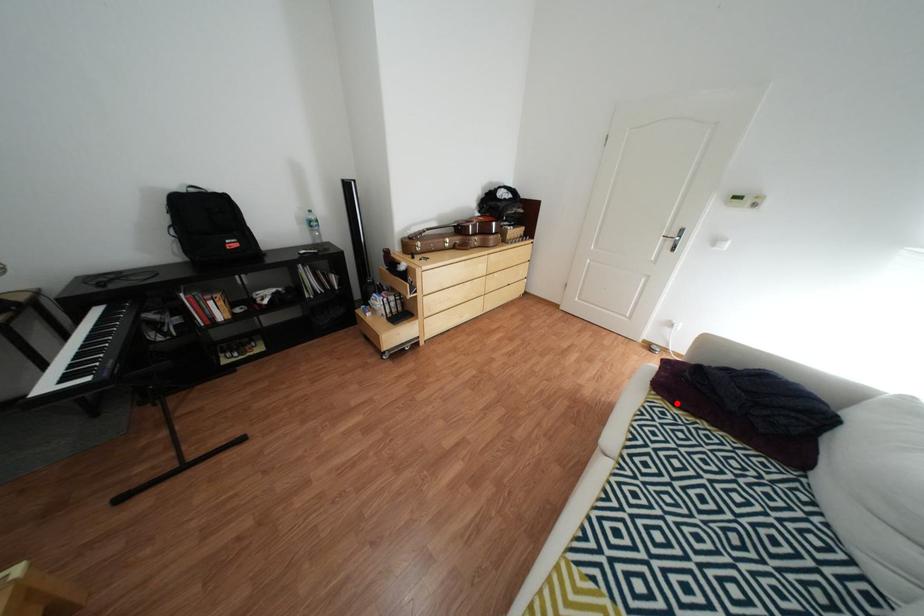
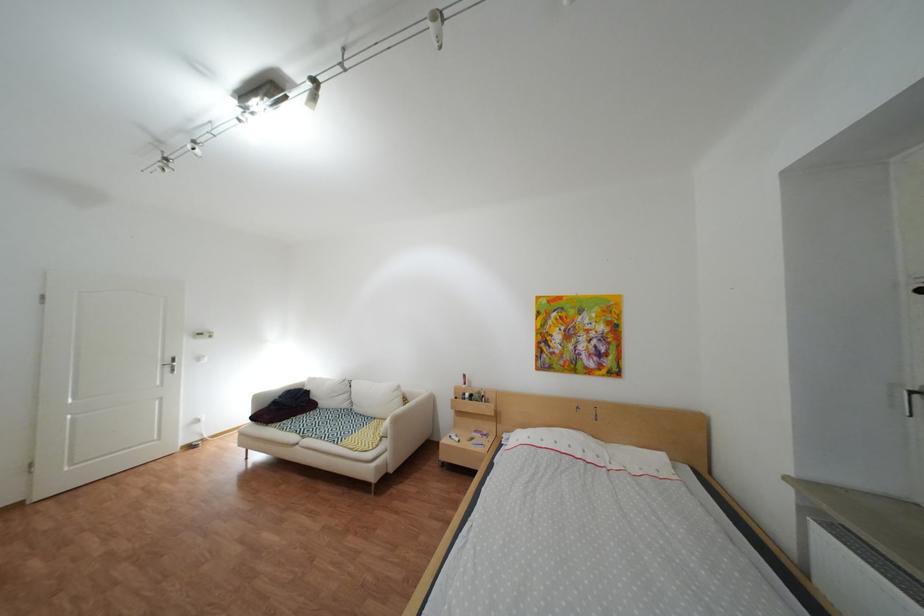
Question: A red point is marked in image1. In image2, is the corresponding 3D point closer to the camera or farther? Reply with the corresponding letter.

Choices:
 (A) The corresponding 3D point is closer.
 (B) The corresponding 3D point is farther.

Answer: (B)